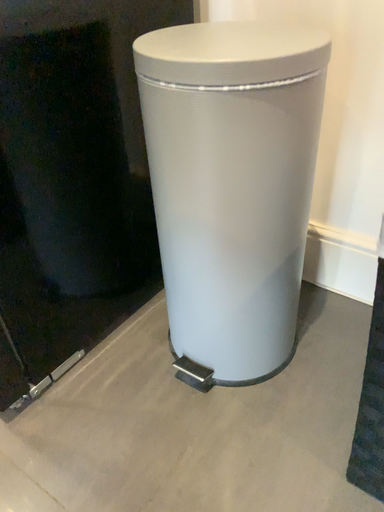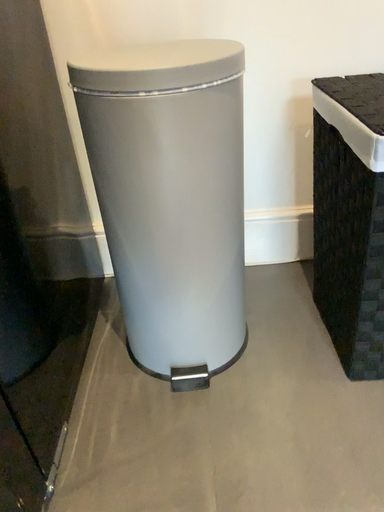
Question: Which way did the camera rotate in the video?

Choices:
 (A) rotated left
 (B) rotated right

Answer: (B)